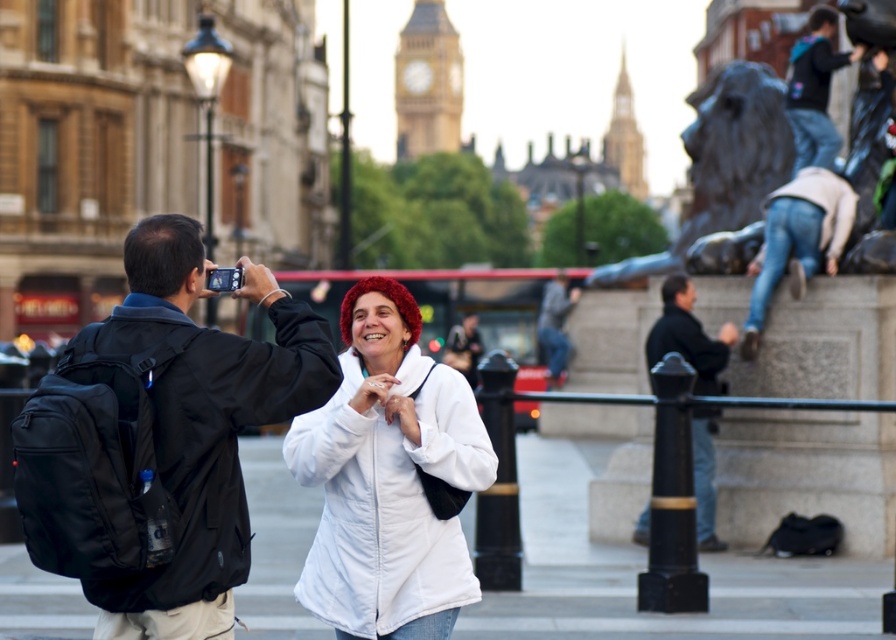
You are a photographer in Trafalgar Square. You notice two items in your shot. One is the dark blue jeans at right and the other is the dark gray jacket at center. Which item appears bigger in the photo?

The dark blue jeans at right appears larger in the photo than the dark gray jacket at center because it is larger in size.

You are a tourist in London and want to take a photo of the golden stone clock tower at upper center and the dark blue jeans at right. Which object should you focus on first if you want to capture both in a single frame without moving the camera?

You should focus on the golden stone clock tower at upper center first because it is larger in size compared to the dark blue jeans at right, allowing it to be more prominent in the frame while still including the smaller dark blue jeans at right.